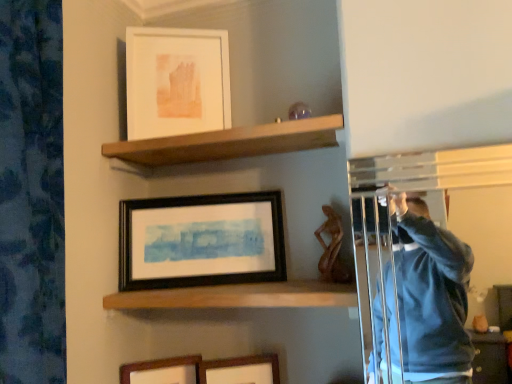
Question: Does wooden shelf at center, which is the 2th shelf in top-to-bottom order, appear on the right side of wooden picture frame at lower center, which is the fourth picture frame in top-to-bottom order?

Choices:
 (A) yes
 (B) no

Answer: (A)

Question: Does wooden shelf at center, which is the 2th shelf in top-to-bottom order, have a lesser height compared to wooden picture frame at lower center, which is the fourth picture frame in top-to-bottom order?

Choices:
 (A) no
 (B) yes

Answer: (B)

Question: Does wooden shelf at center, which is the 2th shelf in top-to-bottom order, turn towards wooden picture frame at lower center, which is the first picture frame from bottom to top?

Choices:
 (A) yes
 (B) no

Answer: (B)

Question: From the image's perspective, is wooden shelf at center, the 1th shelf in the bottom-to-top sequence, under wooden picture frame at lower center, which is the fourth picture frame in top-to-bottom order?

Choices:
 (A) no
 (B) yes

Answer: (A)

Question: Is wooden picture frame at lower center, which is the fourth picture frame in top-to-bottom order, at the back of wooden shelf at center, the 1th shelf in the bottom-to-top sequence?

Choices:
 (A) no
 (B) yes

Answer: (A)

Question: Looking at the image, does wooden picture frame at lower center, the second picture frame from the bottom, seem bigger or smaller compared to black matte picture frame at center, which ranks as the 2th picture frame in top-to-bottom order?

Choices:
 (A) big
 (B) small

Answer: (B)

Question: From a real-world perspective, is wooden picture frame at lower center, the second picture frame from the bottom, above or below black matte picture frame at center, which ranks as the 2th picture frame in top-to-bottom order?

Choices:
 (A) below
 (B) above

Answer: (A)

Question: Would you say wooden picture frame at lower center, the 3th picture frame from the top, is inside or outside black matte picture frame at center, the third picture frame in the bottom-to-top sequence?

Choices:
 (A) inside
 (B) outside

Answer: (B)

Question: In the image, is wooden picture frame at lower center, the second picture frame from the bottom, on the left side or the right side of black matte picture frame at center, which ranks as the 2th picture frame in top-to-bottom order?

Choices:
 (A) left
 (B) right

Answer: (B)

Question: Relative to black matte picture frame at center, which ranks as the 2th picture frame in top-to-bottom order, is wooden shelf at upper center, which ranks as the 2th shelf in bottom-to-top order, in front or behind?

Choices:
 (A) behind
 (B) front

Answer: (B)

Question: In terms of size, does wooden shelf at upper center, which is counted as the first shelf, starting from the top, appear bigger or smaller than black matte picture frame at center, the third picture frame in the bottom-to-top sequence?

Choices:
 (A) small
 (B) big

Answer: (B)

Question: Is wooden shelf at upper center, which ranks as the 2th shelf in bottom-to-top order, situated inside black matte picture frame at center, which ranks as the 2th picture frame in top-to-bottom order, or outside?

Choices:
 (A) inside
 (B) outside

Answer: (B)

Question: Considering the positions of point (251, 155) and point (260, 221), is point (251, 155) closer or farther from the camera than point (260, 221)?

Choices:
 (A) farther
 (B) closer

Answer: (A)

Question: Relative to wooden shelf at upper center, which is counted as the first shelf, starting from the top, is black matte picture frame at center, which ranks as the 2th picture frame in top-to-bottom order, in front or behind?

Choices:
 (A) behind
 (B) front

Answer: (A)

Question: In the image, is black matte picture frame at center, which ranks as the 2th picture frame in top-to-bottom order, on the left side or the right side of wooden shelf at upper center, which ranks as the 2th shelf in bottom-to-top order?

Choices:
 (A) right
 (B) left

Answer: (B)